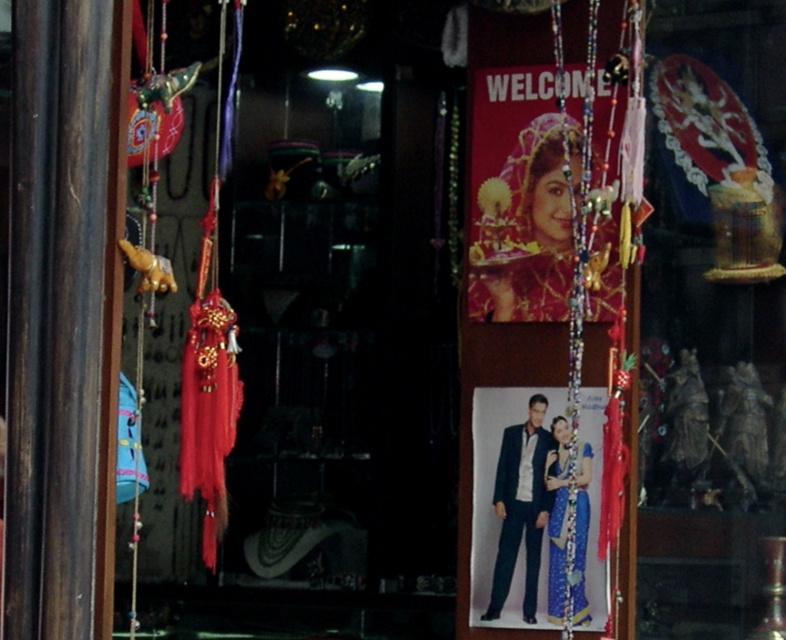
You are a customer entering the shop and want to see both the matte gold jewelry at center and the blue silk saree at center. Which one will you see first when you walk in?

The matte gold jewelry at center is in front of the blue silk saree at center, so you will see the matte gold jewelry at center first when you walk in.

You are a customer entering the shop and see the dark blue suit at center and the blue silk saree at center. Which item is closer to you as you stand at the entrance?

The dark blue suit at center is closer to you than the blue silk saree at center because it is further to the viewer.

You are a customer in the shop and want to see both the matte gold jewelry at center and the blue silk saree at center. Which one is higher up in the display?

The matte gold jewelry at center is taller than the blue silk saree at center, so it is higher up in the display.